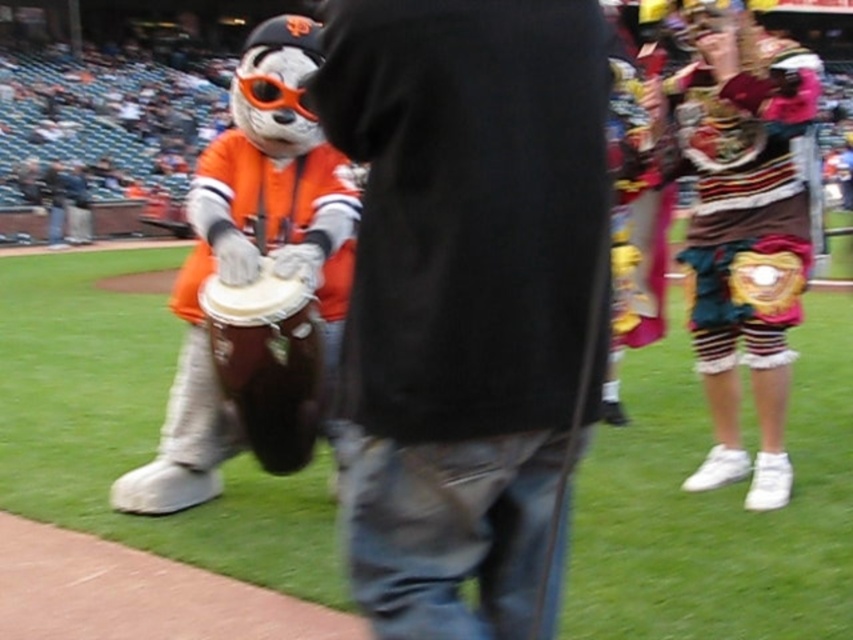
Question: Is black cotton shirt at center smaller than orange fabric mascot at left?

Choices:
 (A) no
 (B) yes

Answer: (B)

Question: Is black cotton shirt at center thinner than striped fabric shorts at center?

Choices:
 (A) no
 (B) yes

Answer: (B)

Question: Among these objects, which one is farthest from the camera?

Choices:
 (A) striped fabric shorts at center
 (B) black cotton shirt at center

Answer: (A)

Question: Which point is farther to the camera?

Choices:
 (A) black cotton shirt at center
 (B) orange fabric mascot at left
 (C) striped fabric shorts at center

Answer: (C)

Question: Does striped fabric shorts at center lie in front of orange fabric mascot at left?

Choices:
 (A) no
 (B) yes

Answer: (A)

Question: Which point is closer to the camera?

Choices:
 (A) black cotton shirt at center
 (B) orange fabric mascot at left
 (C) striped fabric shorts at center

Answer: (A)